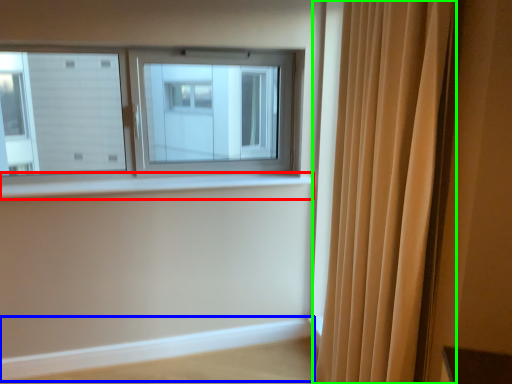
Question: Which object is positioned closest to window sill (highlighted by a red box)? Select from ledge (highlighted by a blue box) and curtain (highlighted by a green box).

Choices:
 (A) ledge
 (B) curtain

Answer: (A)